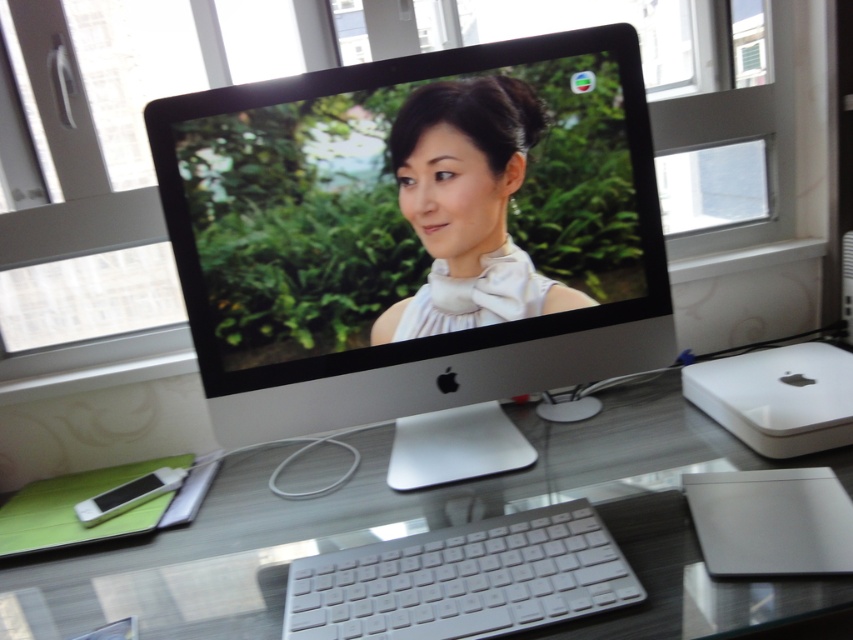
Question: Does silver metallic laptop at lower right have a greater width compared to white plastic minimac at lower right?

Choices:
 (A) no
 (B) yes

Answer: (A)

Question: Which point is farther from the camera taking this photo?

Choices:
 (A) (575, 195)
 (B) (579, 513)

Answer: (A)

Question: Is silver metallic computer monitor at center positioned at the back of white plastic keyboard at center?

Choices:
 (A) yes
 (B) no

Answer: (A)

Question: Which object is the farthest from the silver metallic laptop at lower right?

Choices:
 (A) white plastic keyboard at center
 (B) white satin bow tie at center

Answer: (B)

Question: Is transparent glass desk at center in front of white plastic keyboard at center?

Choices:
 (A) yes
 (B) no

Answer: (A)

Question: Which of these objects is positioned closest to the white plastic keyboard at center?

Choices:
 (A) transparent glass desk at center
 (B) silver metallic laptop at lower right
 (C) silver metallic computer monitor at center

Answer: (A)